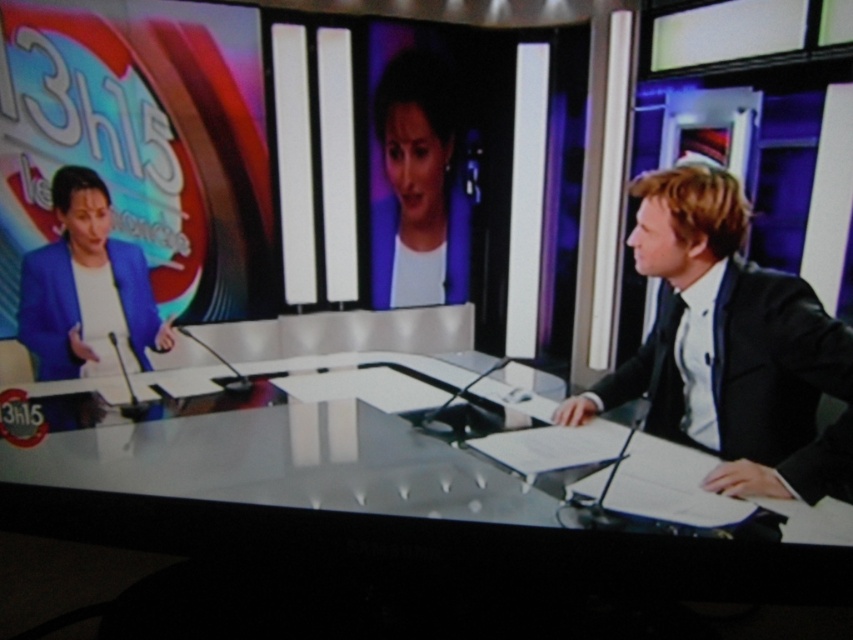
You are a camera operator adjusting the focus on your lens. You need to ensure both the white glossy table at center and the black glossy suit at right are in focus. Which object should you focus on first to ensure proper depth of field?

The white glossy table at center is further to the viewer than the black glossy suit at right, so you should focus on the white glossy table at center first to ensure proper depth of field.

You are a camera operator adjusting the focus on your lens. You need to ensure both the black glossy suit at right and the matte white shirt at center are in focus. Which object should you focus on first to ensure the other is also in focus?

The black glossy suit at right is in front of the matte white shirt at center. To ensure both are in focus, focus on the black glossy suit at right first since it is closer to the camera, and the matte white shirt at center will naturally fall into focus as it is behind.